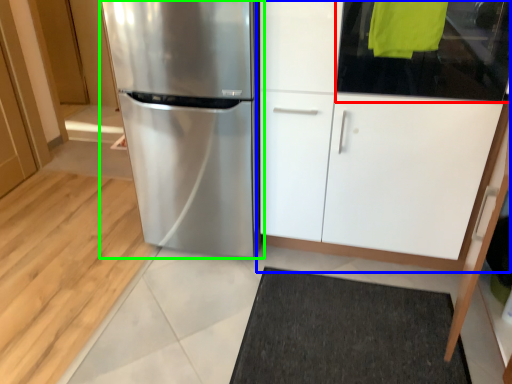
Question: Which object is positioned closest to glass door (highlighted by a red box)? Select from cabinetry (highlighted by a blue box) and refrigerator (highlighted by a green box).

Choices:
 (A) cabinetry
 (B) refrigerator

Answer: (A)